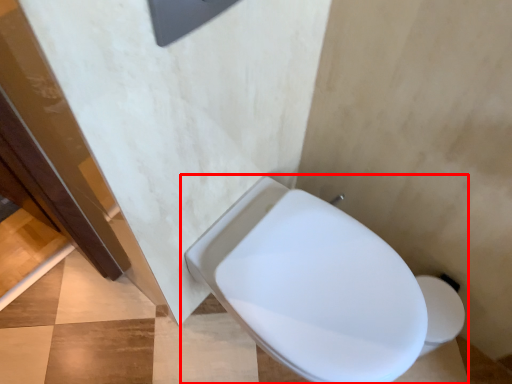
Question: Where is toilet (annotated by the red box) located in relation to concrete in the image?

Choices:
 (A) left
 (B) right

Answer: (B)